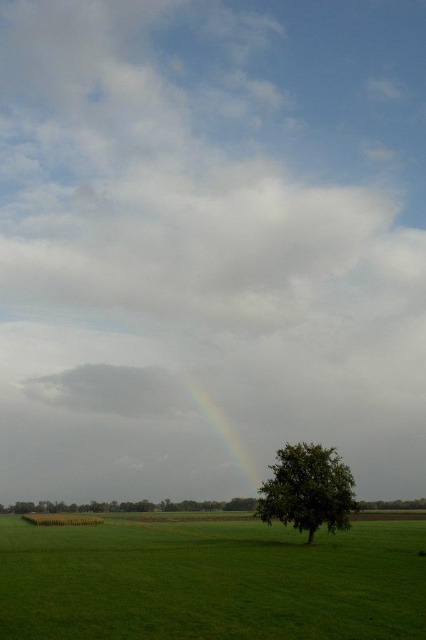
Question: Which object appears closest to the camera in this image?

Choices:
 (A) green leafy tree at lower right
 (B) green grassy field at lower left

Answer: (B)

Question: Does green leafy tree at lower right appear on the left side of rainbow at center?

Choices:
 (A) yes
 (B) no

Answer: (B)

Question: Estimate the real-world distances between objects in this image. Which object is closer to the green grassy field at lower left?

Choices:
 (A) green leafy tree at lower right
 (B) rainbow at center

Answer: (A)

Question: Which object appears farthest from the camera in this image?

Choices:
 (A) green grassy field at lower left
 (B) green leafy tree at lower right

Answer: (B)

Question: Is green grassy field at lower left to the right of green leafy tree at lower right from the viewer's perspective?

Choices:
 (A) yes
 (B) no

Answer: (B)

Question: In this image, where is green leafy tree at lower right located relative to rainbow at center?

Choices:
 (A) left
 (B) right

Answer: (B)